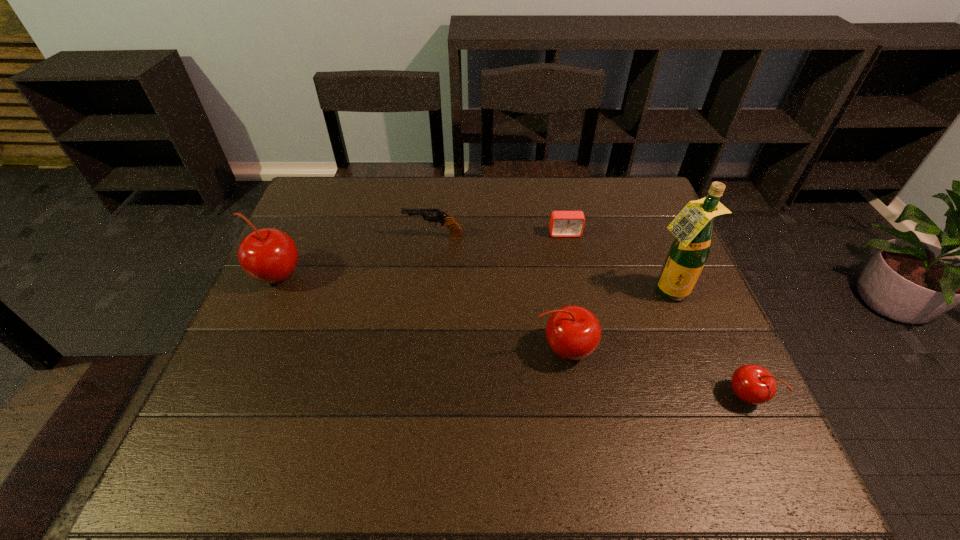
This screenshot has width=960, height=540. Identify the location of the leftmost cherry. (268, 255).

Identify the location of the leftmost object. The width and height of the screenshot is (960, 540). (268, 255).

I want to click on the second nearest object, so click(573, 332).

This screenshot has width=960, height=540. I want to click on the second nearest cherry, so click(x=573, y=332).

At what (x,y) coordinates should I click in order to perform the action: click on the shortest cherry. Please return your answer as a coordinate pair (x, y). This screenshot has height=540, width=960. Looking at the image, I should click on (753, 384).

Locate an element on the screen. the rightmost cherry is located at coordinates (753, 384).

Image resolution: width=960 pixels, height=540 pixels. Identify the location of alarm clock. (562, 223).

Where is `the tallest object`? The height and width of the screenshot is (540, 960). the tallest object is located at coordinates (693, 227).

You are a GUI agent. You are given a task and a screenshot of the screen. Output one action in this format:
    pyautogui.click(x=<x>, y=<y>)
    Task: Click on the gun
    The image size is (960, 540).
    Given the screenshot: What is the action you would take?
    pyautogui.click(x=432, y=215)

At what (x,y) coordinates should I click in order to perform the action: click on vacant space situated 0.330m on the front of the leftmost cherry. Please return your answer as a coordinate pair (x, y). The image size is (960, 540). Looking at the image, I should click on (214, 416).